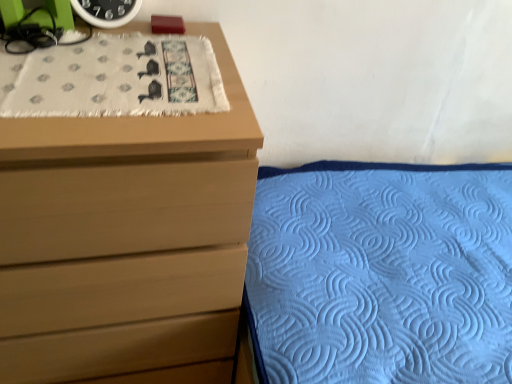
Question: Could you tell me if white textured cloth at upper left is facing green matte clock at upper left?

Choices:
 (A) no
 (B) yes

Answer: (A)

Question: Is white textured cloth at upper left thinner than green matte clock at upper left?

Choices:
 (A) no
 (B) yes

Answer: (A)

Question: Is white textured cloth at upper left at the left side of green matte clock at upper left?

Choices:
 (A) yes
 (B) no

Answer: (B)

Question: From a real-world perspective, is white textured cloth at upper left on green matte clock at upper left?

Choices:
 (A) yes
 (B) no

Answer: (B)

Question: Does white textured cloth at upper left touch green matte clock at upper left?

Choices:
 (A) no
 (B) yes

Answer: (A)

Question: Based on their sizes in the image, would you say blue quilted fabric at lower right is bigger or smaller than matte wood chest of drawers at upper left?

Choices:
 (A) big
 (B) small

Answer: (A)

Question: Considering the positions of point (288, 258) and point (73, 311), is point (288, 258) closer or farther from the camera than point (73, 311)?

Choices:
 (A) closer
 (B) farther

Answer: (B)

Question: From a real-world perspective, is blue quilted fabric at lower right physically located above or below matte wood chest of drawers at upper left?

Choices:
 (A) below
 (B) above

Answer: (A)

Question: Considering the positions of blue quilted fabric at lower right and matte wood chest of drawers at upper left in the image, is blue quilted fabric at lower right taller or shorter than matte wood chest of drawers at upper left?

Choices:
 (A) short
 (B) tall

Answer: (A)

Question: In terms of size, does white textured cloth at upper left appear bigger or smaller than green matte clock at upper left?

Choices:
 (A) small
 (B) big

Answer: (B)

Question: From the image's perspective, relative to green matte clock at upper left, is white textured cloth at upper left above or below?

Choices:
 (A) above
 (B) below

Answer: (B)

Question: Is white textured cloth at upper left in front of or behind green matte clock at upper left in the image?

Choices:
 (A) behind
 (B) front

Answer: (B)

Question: Based on their positions, is white textured cloth at upper left located to the left or right of green matte clock at upper left?

Choices:
 (A) left
 (B) right

Answer: (B)

Question: Considering the positions of point (135, 6) and point (326, 337), is point (135, 6) closer or farther from the camera than point (326, 337)?

Choices:
 (A) farther
 (B) closer

Answer: (A)

Question: From their relative heights in the image, would you say green matte clock at upper left is taller or shorter than blue quilted fabric at lower right?

Choices:
 (A) tall
 (B) short

Answer: (B)